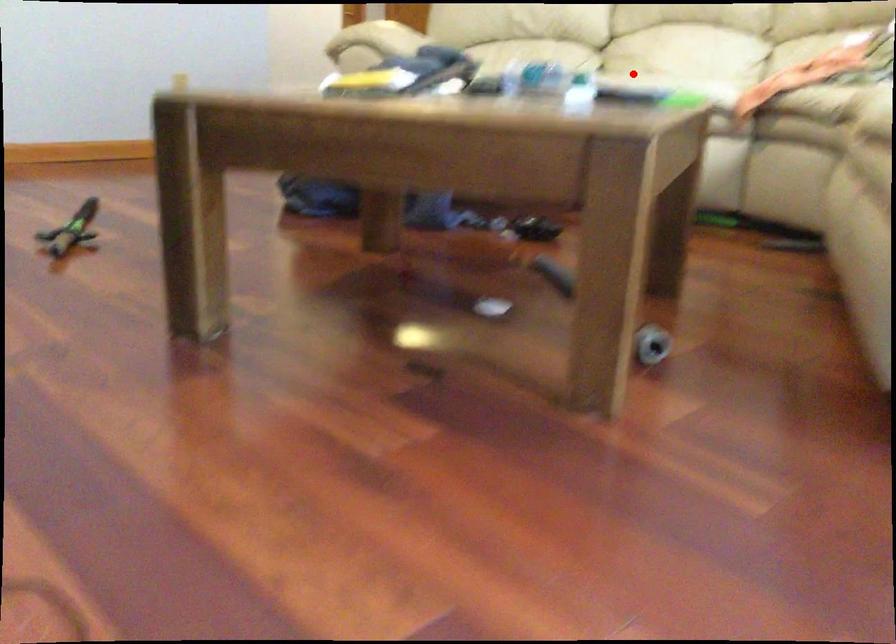
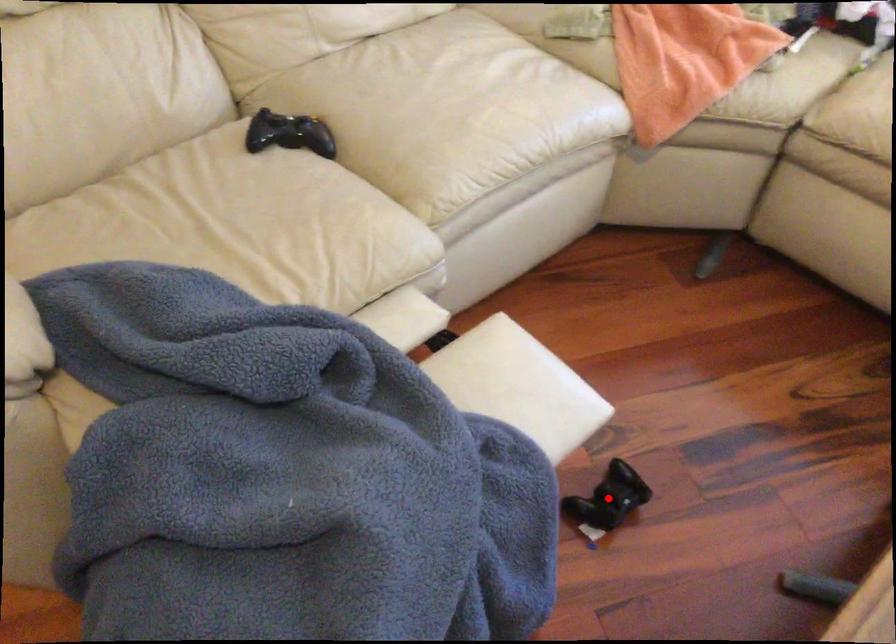
I am providing you with two images of the same scene from different viewpoints. A red point is marked on the first image and another point is marked on the second image. Does the point marked in image1 correspond to the same location as the one in image2?

No